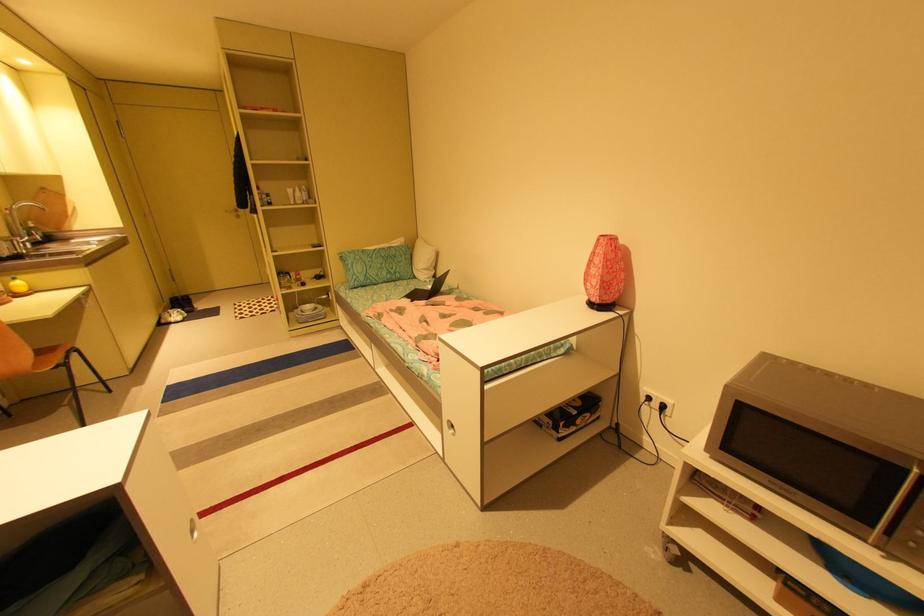
Describe the element at coordinates (233, 211) in the screenshot. I see `a silver door handle` at that location.